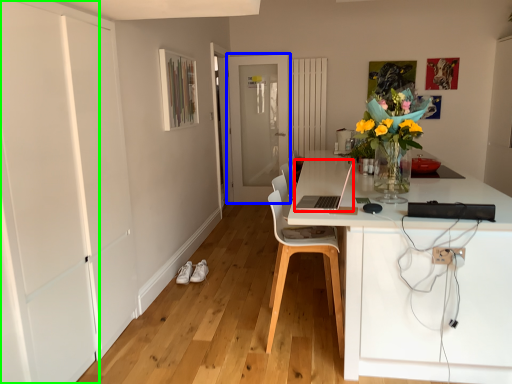
Question: Which object is the closest to the computer (highlighted by a red box)? Choose among these: door (highlighted by a blue box) or door (highlighted by a green box).

Choices:
 (A) door
 (B) door

Answer: (B)